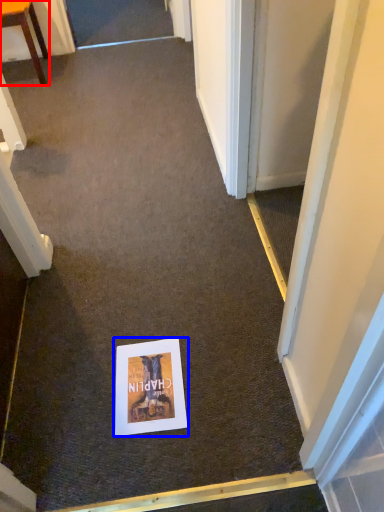
Question: Which object appears closest to the camera in this image, furniture (highlighted by a red box) or poster page (highlighted by a blue box)?

Choices:
 (A) furniture
 (B) poster page

Answer: (B)